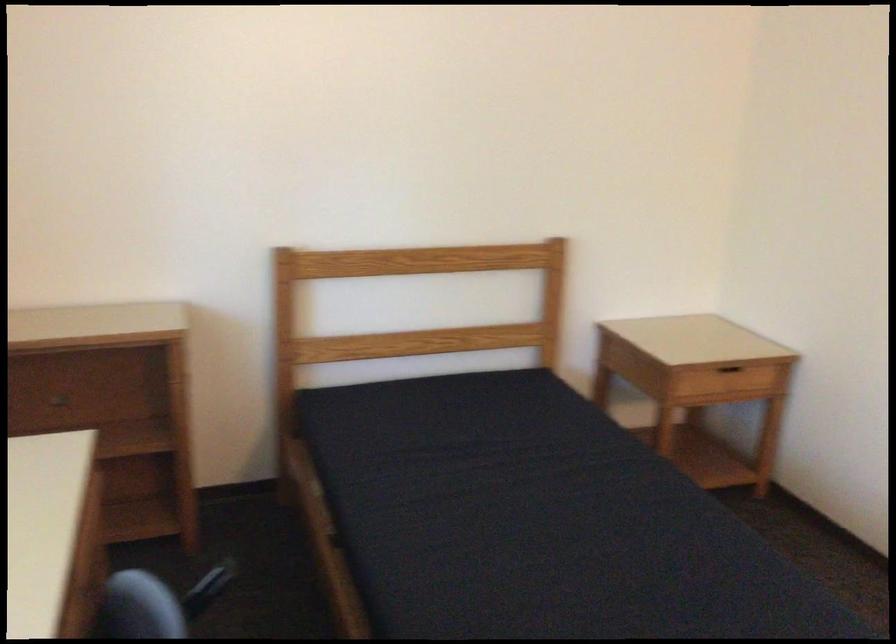
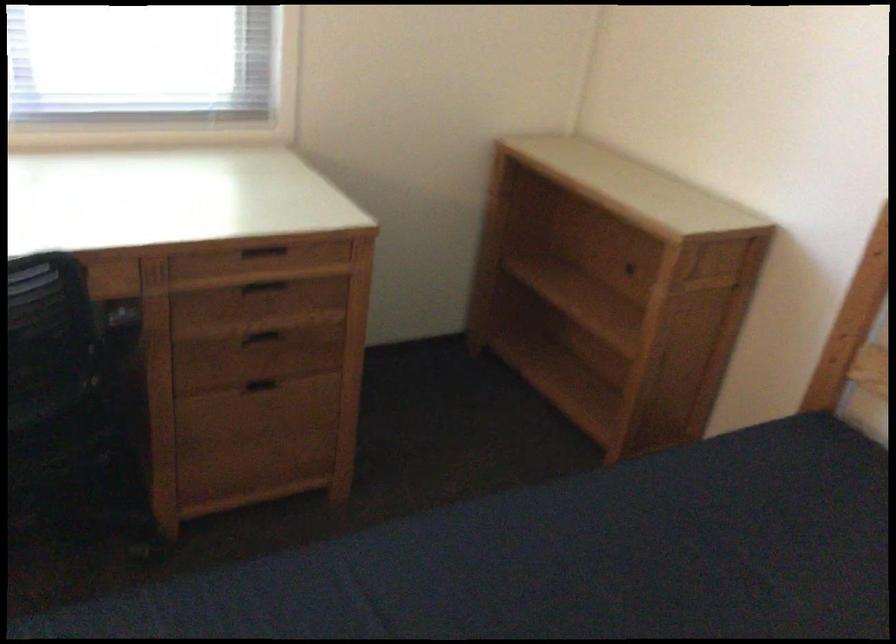
Locate, in the second image, the point that corresponds to pixel 80 511 in the first image.

(263, 252)